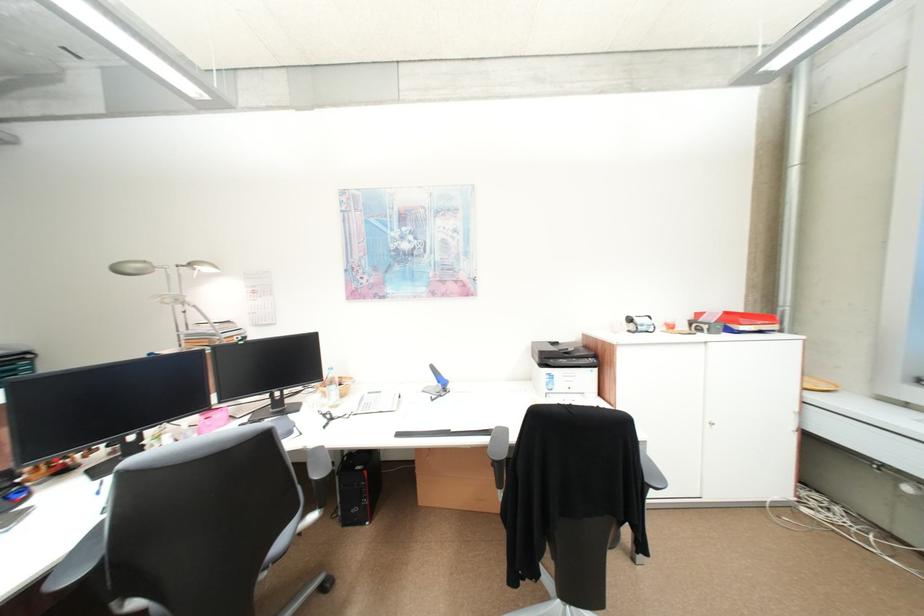
Find where to lift the clear water bottle. Please return your answer as a coordinate pair (x, y).

(332, 387)